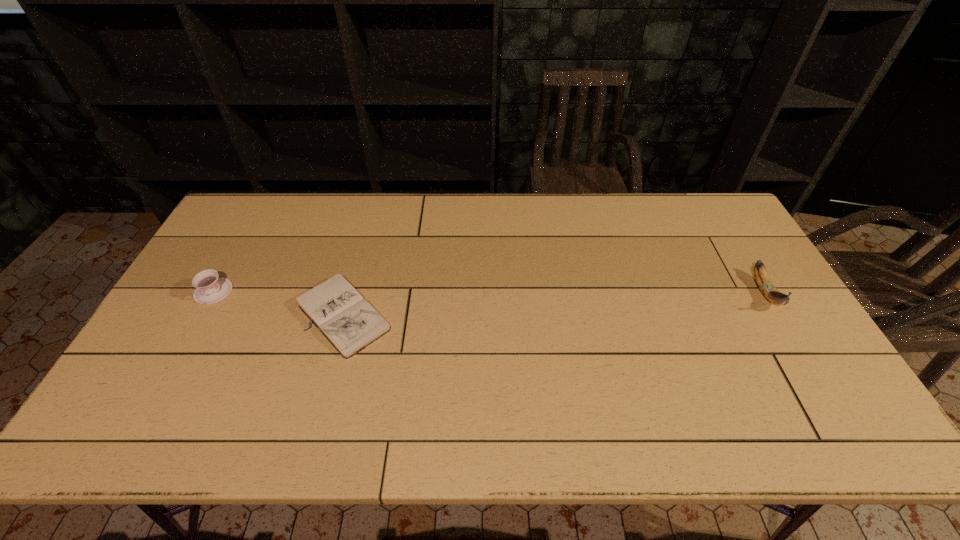
Identify the location of the rightmost object. This screenshot has height=540, width=960. (765, 285).

Locate an element on the screen. banana is located at coordinates (765, 285).

You are a GUI agent. You are given a task and a screenshot of the screen. Output one action in this format:
    pyautogui.click(x=<x>, y=<y>)
    Task: Click on the leftmost object
    
    Given the screenshot: What is the action you would take?
    pos(210,288)

Locate an element on the screen. The width and height of the screenshot is (960, 540). teacup is located at coordinates (210, 288).

Identify the location of notebook. (350, 323).

Locate an element on the screen. Image resolution: width=960 pixels, height=540 pixels. the second object from right to left is located at coordinates (350, 323).

The height and width of the screenshot is (540, 960). Find the location of `free region located on the peel of the rightmost object`. free region located on the peel of the rightmost object is located at coordinates (852, 436).

Where is `vacant area situated 0.150m on the handle side of the leftmost object`? vacant area situated 0.150m on the handle side of the leftmost object is located at coordinates (181, 349).

Where is `vacant space located on the back of the shortest object`? This screenshot has height=540, width=960. vacant space located on the back of the shortest object is located at coordinates (358, 264).

The height and width of the screenshot is (540, 960). Identify the location of object located at the left edge. (210, 288).